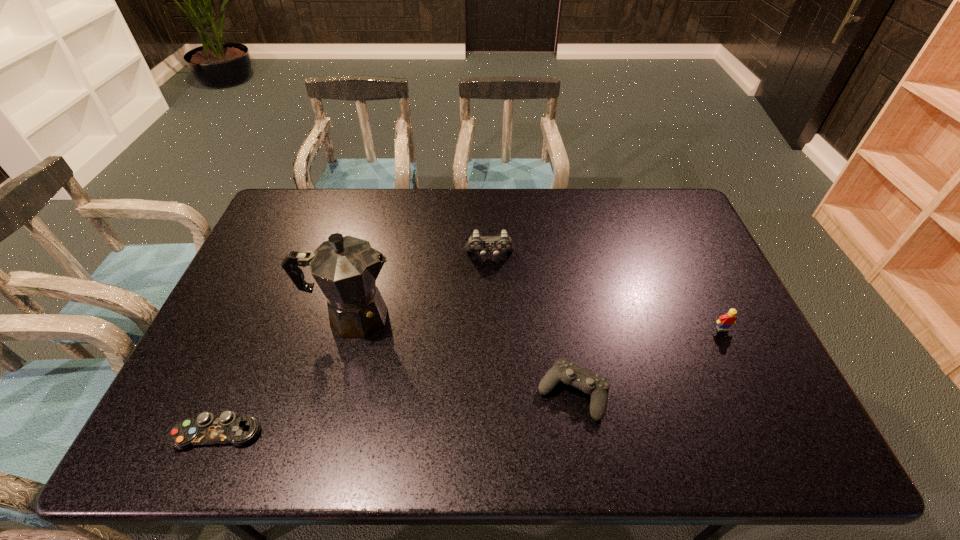
The height and width of the screenshot is (540, 960). In order to click on the second object from left to right in this screenshot , I will do `click(345, 268)`.

Locate an element on the screen. The image size is (960, 540). the tallest object is located at coordinates (345, 268).

What are the coordinates of `the tallest control` in the screenshot? It's located at (476, 243).

At what (x,y) coordinates should I click in order to perform the action: click on the second control from right to left. Please return your answer as a coordinate pair (x, y). Looking at the image, I should click on (476, 243).

In order to click on the rightmost object in this screenshot , I will do `click(725, 321)`.

The height and width of the screenshot is (540, 960). Find the location of `the third shortest object`. the third shortest object is located at coordinates (725, 321).

Image resolution: width=960 pixels, height=540 pixels. Find the location of `the fourth tallest object`. the fourth tallest object is located at coordinates (597, 386).

Find the location of a particular element. the fourth object from left to right is located at coordinates (597, 386).

You are a GUI agent. You are given a task and a screenshot of the screen. Output one action in this format:
    pyautogui.click(x=<x>, y=<y>)
    Task: Click on the leftmost control
    The image size is (960, 540).
    Given the screenshot: What is the action you would take?
    [x=227, y=428]

This screenshot has width=960, height=540. I want to click on the shortest object, so click(x=227, y=428).